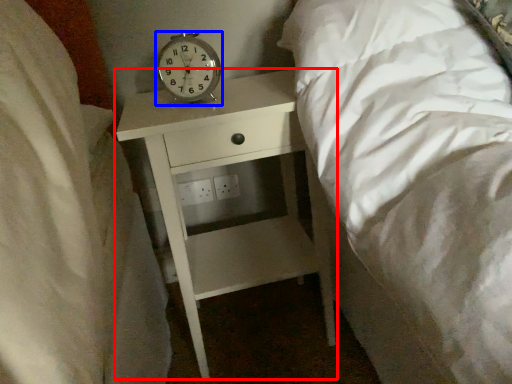
Question: Which object is closer to the camera taking this photo, nightstand (highlighted by a red box) or alarm clock (highlighted by a blue box)?

Choices:
 (A) nightstand
 (B) alarm clock

Answer: (A)